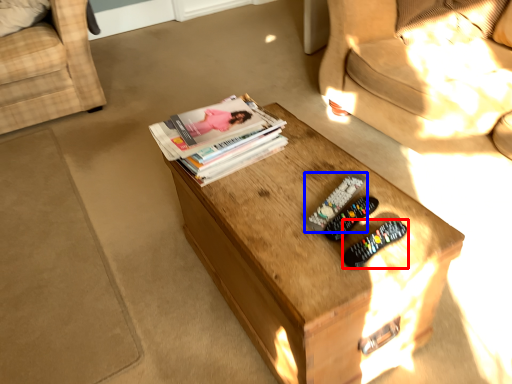
Question: Which object is further to the camera taking this photo, remote control (highlighted by a red box) or remote control (highlighted by a blue box)?

Choices:
 (A) remote control
 (B) remote control

Answer: (B)